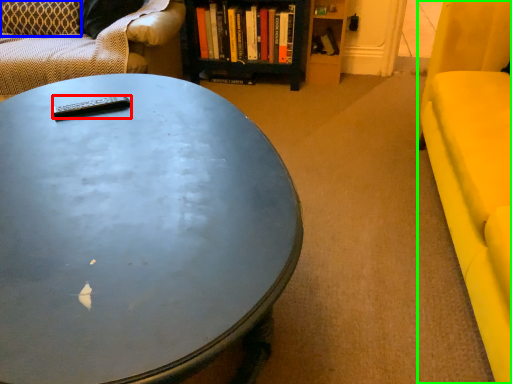
Question: Which object is the farthest from remote control (highlighted by a red box)? Choose among these: pillow (highlighted by a blue box) or armchair (highlighted by a green box).

Choices:
 (A) pillow
 (B) armchair

Answer: (A)